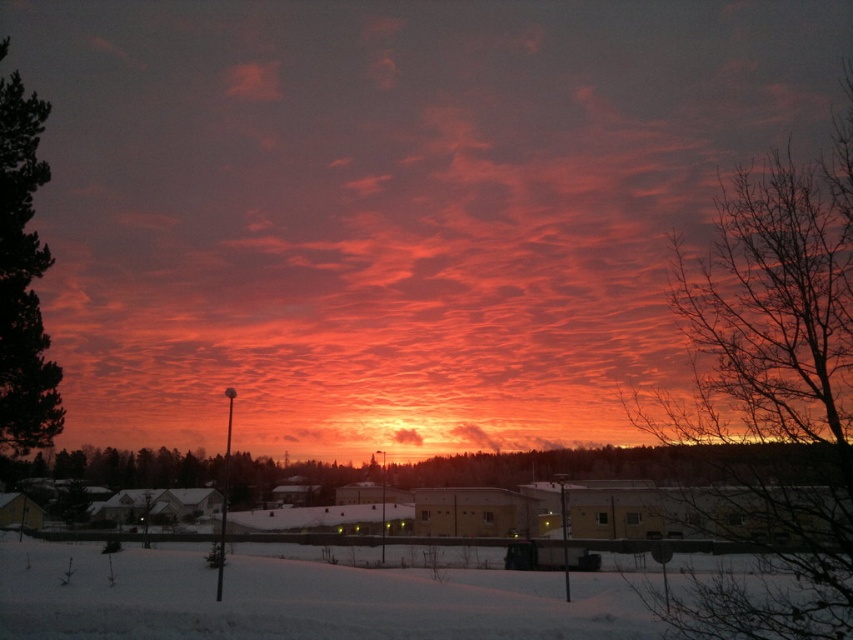
Can you confirm if matte orange cloud at center is thinner than bare branches at upper right?

No.

Between point (805, 77) and point (698, 285), which one is positioned behind?

The point (805, 77) is behind.

Where is `matte orange cloud at center`? Image resolution: width=853 pixels, height=640 pixels. matte orange cloud at center is located at coordinates (392, 205).

Can you confirm if green textured pine tree at left is positioned below orange cotton cloud at center?

No, green textured pine tree at left is not below orange cotton cloud at center.

Is green textured pine tree at left further to the viewer compared to orange cotton cloud at center?

No, it is not.

Between point (39, 244) and point (412, 433), which one is positioned behind?

Positioned behind is point (412, 433).

Find the location of a particular element. The image size is (853, 640). green textured pine tree at left is located at coordinates (22, 278).

Which is more to the right, bare branches at upper right or orange cotton cloud at center?

From the viewer's perspective, bare branches at upper right appears more on the right side.

Is bare branches at upper right wider than orange cotton cloud at center?

Yes.

Is point (813, 442) positioned after point (409, 440)?

No, (813, 442) is in front of (409, 440).

Where is `bare branches at upper right`? bare branches at upper right is located at coordinates (775, 384).